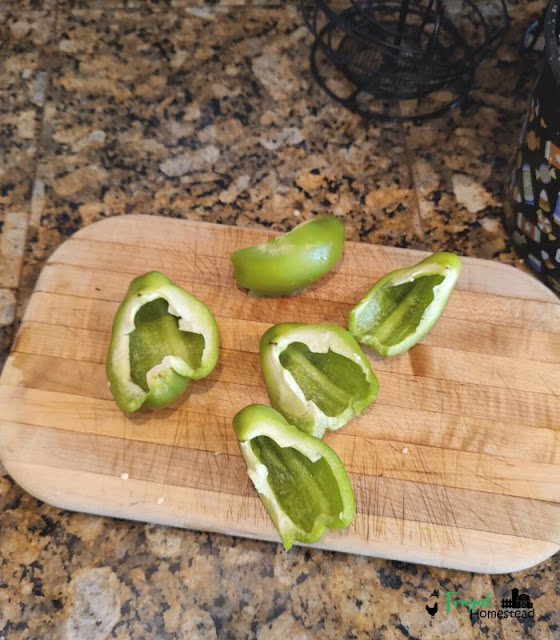
You are a GUI agent. You are given a task and a screenshot of the screen. Output one action in this format:
    pyautogui.click(x=<x>, y=<y>)
    Task: Click on the black metal holder
    
    Given the screenshot: What is the action you would take?
    pyautogui.click(x=404, y=77)